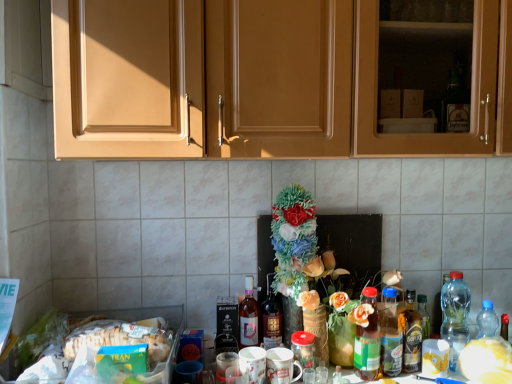
Question: Which direction should I rotate to look at shiny dark brown bottle at center, which appears as the 2th bottle when viewed from the left?

Choices:
 (A) right
 (B) left

Answer: (A)

Question: Should I look upward or downward to see white matte flower at center?

Choices:
 (A) down
 (B) up

Answer: (A)

Question: Can you confirm if translucent plastic bottles at center-right, placed as the fourth bottle when sorted from left to right, is wider than green matte box of tran at lower left?

Choices:
 (A) no
 (B) yes

Answer: (A)

Question: Is translucent plastic bottles at center-right, placed as the fourth bottle when sorted from left to right, positioned with its back to green matte box of tran at lower left?

Choices:
 (A) no
 (B) yes

Answer: (A)

Question: Is translucent plastic bottles at center-right, placed as the fourth bottle when sorted from left to right, taller than green matte box of tran at lower left?

Choices:
 (A) yes
 (B) no

Answer: (A)

Question: Does translucent plastic bottles at center-right, the third bottle from the right, turn towards green matte box of tran at lower left?

Choices:
 (A) no
 (B) yes

Answer: (A)

Question: Is translucent plastic bottles at center-right, the third bottle from the right, positioned before green matte box of tran at lower left?

Choices:
 (A) no
 (B) yes

Answer: (A)

Question: Can you confirm if translucent plastic bottles at center-right, placed as the fourth bottle when sorted from left to right, is shorter than green matte box of tran at lower left?

Choices:
 (A) yes
 (B) no

Answer: (B)

Question: Can you confirm if white matte flower at center is smaller than green glass bottle at center, the fourth bottle from the right?

Choices:
 (A) no
 (B) yes

Answer: (B)

Question: From a real-world perspective, does white matte flower at center sit lower than green glass bottle at center, the 3th bottle when ordered from left to right?

Choices:
 (A) yes
 (B) no

Answer: (A)

Question: Does white matte flower at center have a greater width compared to green glass bottle at center, the 3th bottle when ordered from left to right?

Choices:
 (A) yes
 (B) no

Answer: (A)

Question: Could you tell me if white matte flower at center is facing green glass bottle at center, the fourth bottle from the right?

Choices:
 (A) no
 (B) yes

Answer: (A)

Question: Does white matte flower at center have a greater height compared to green glass bottle at center, the 3th bottle when ordered from left to right?

Choices:
 (A) yes
 (B) no

Answer: (B)

Question: Is white matte flower at center positioned beyond the bounds of green glass bottle at center, the fourth bottle from the right?

Choices:
 (A) yes
 (B) no

Answer: (A)

Question: Is the depth of green glass bottle at center, the 3th bottle when ordered from left to right, less than that of green matte box of tran at lower left?

Choices:
 (A) yes
 (B) no

Answer: (B)